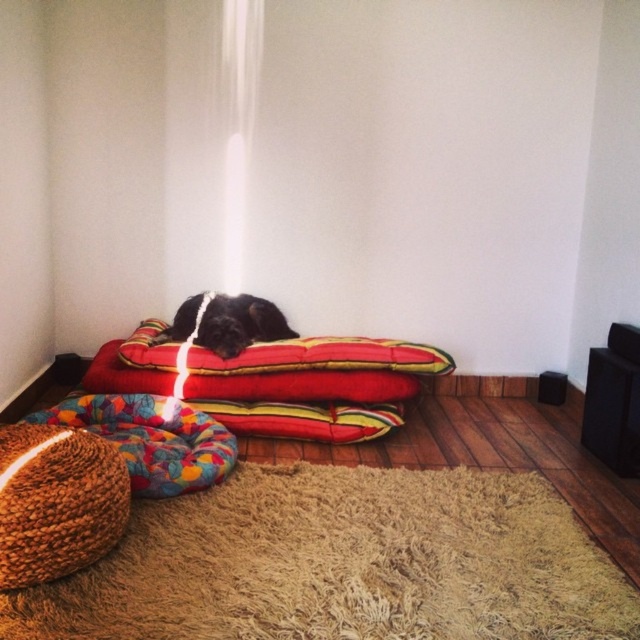
Question: Does multicolored fabric dog bed at lower left appear on the right side of black fur dog at center?

Choices:
 (A) yes
 (B) no

Answer: (B)

Question: Among these objects, which one is nearest to the camera?

Choices:
 (A) multicolored fabric dog bed at lower left
 (B) brown knitted bean bag chair at lower left

Answer: (B)

Question: Which object is the closest to the soft beige carpet at center?

Choices:
 (A) multicolored fabric dog bed at lower left
 (B) brown knitted bean bag chair at lower left

Answer: (B)

Question: In this image, where is soft beige carpet at center located relative to multicolored fabric dog bed at lower left?

Choices:
 (A) right
 (B) left

Answer: (A)

Question: Does soft beige carpet at center have a larger size compared to multicolored fabric dog bed at lower left?

Choices:
 (A) yes
 (B) no

Answer: (A)

Question: Which object is positioned farthest from the black fur dog at center?

Choices:
 (A) multicolored fabric dog bed at lower left
 (B) brown knitted bean bag chair at lower left
 (C) soft beige carpet at center

Answer: (B)